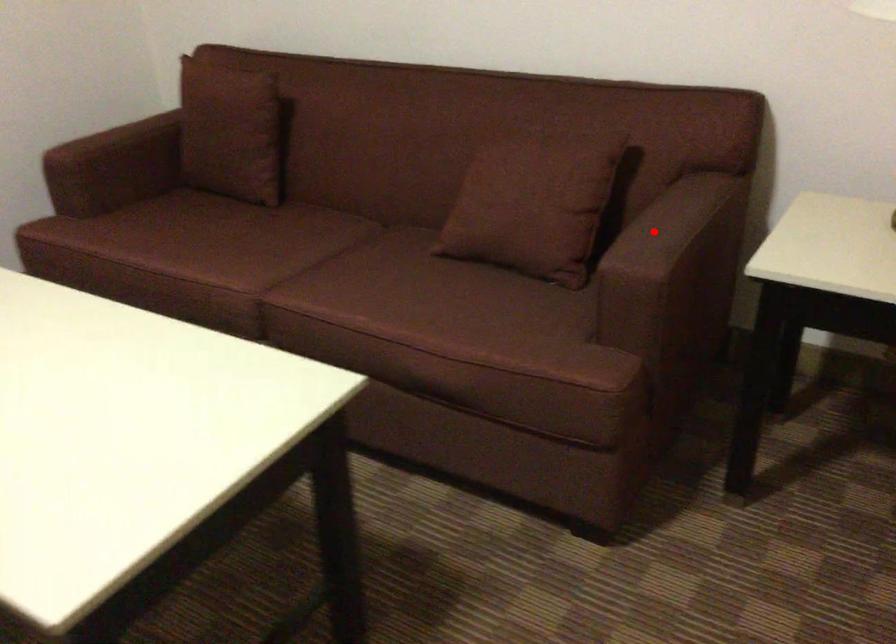
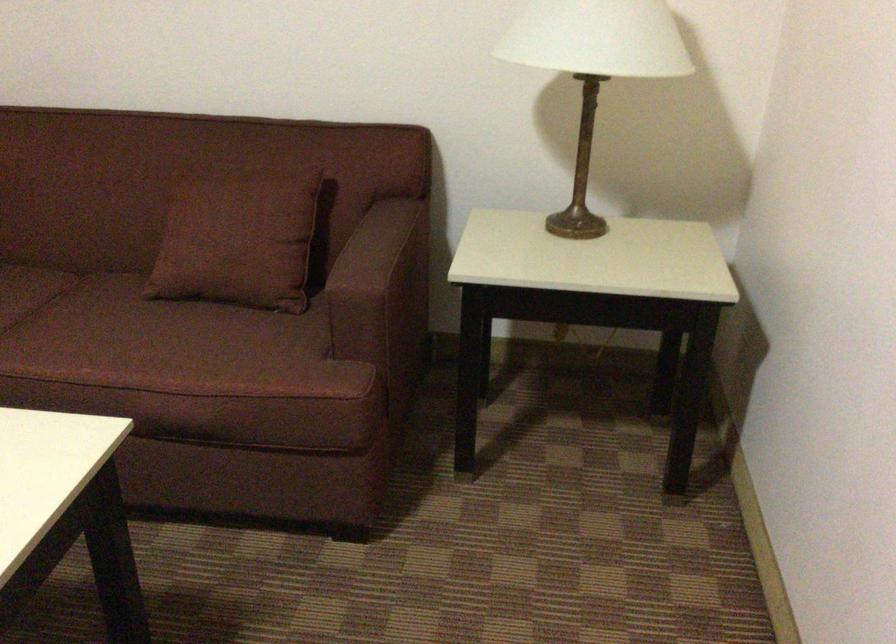
Question: I am providing you with two images of the same scene from different viewpoints. A red point is shown in image1. For the corresponding object point in image2, is it positioned nearer or farther from the camera?

Choices:
 (A) Nearer
 (B) Farther

Answer: (B)